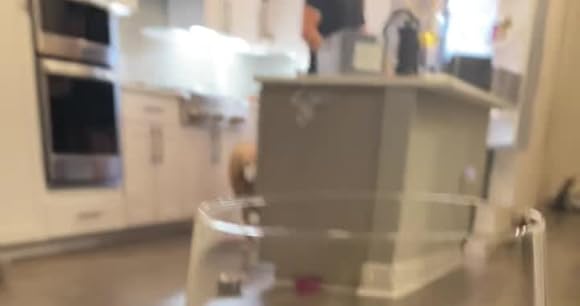
This screenshot has height=306, width=580. What are the coordinates of `rim of glass` in the screenshot? It's located at (221, 223).